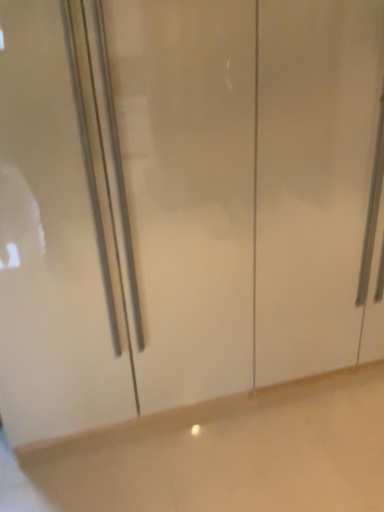
The height and width of the screenshot is (512, 384). What do you see at coordinates (221, 455) in the screenshot? I see `white glossy cabinet at center` at bounding box center [221, 455].

Where is `white glossy cabinet at center`? The image size is (384, 512). white glossy cabinet at center is located at coordinates (221, 455).

Where is `white glossy cabinet at center`? The width and height of the screenshot is (384, 512). white glossy cabinet at center is located at coordinates (221, 455).